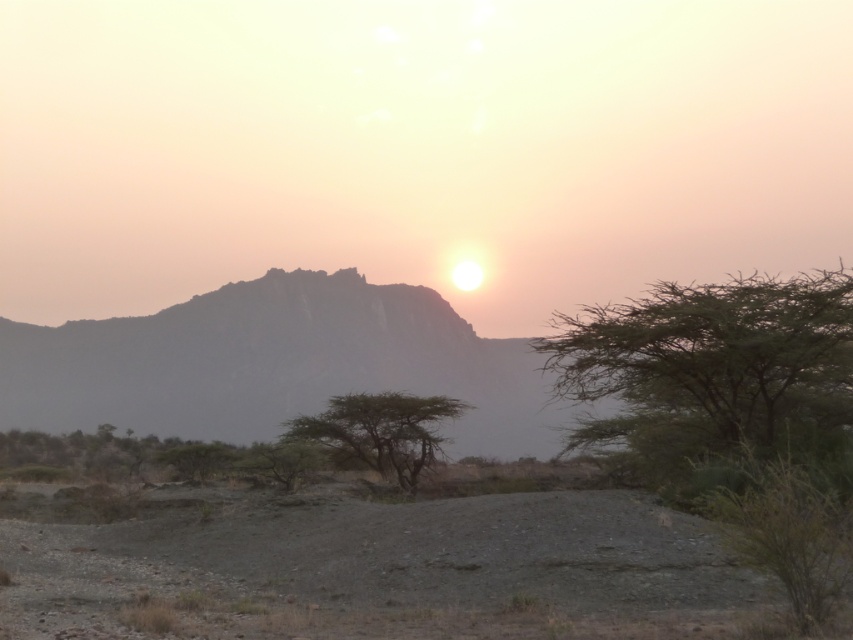
From the picture: You are standing on the gray gravelly dirt field at lower center and want to walk to the green leafy tree at right. Which direction should you head towards?

The green leafy tree at right is located to your right side, so you should head towards the right direction to reach it.

You are standing at the center of the image and want to walk towards the green leafy tree at right. In which direction should you move?

You should move towards the right direction to reach the green leafy tree at right since its 2D location is at point (711, 369), which is positioned to the right side of the image.

You are standing on the gray gravelly dirt field at lower center and want to walk towards the green matte tree at center. Which direction should you move to reach it?

You should move backward because the gray gravelly dirt field at lower center is in front of the green matte tree at center, meaning the tree is behind you.